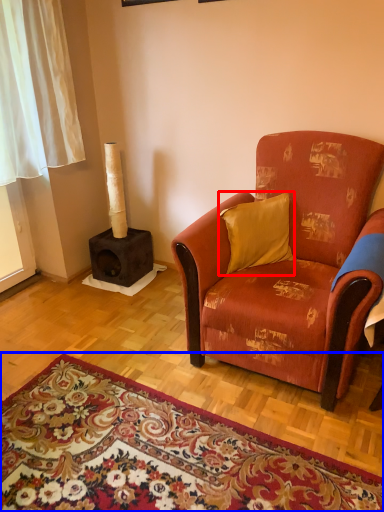
Question: Which of the following is the closest to the observer, pillow (highlighted by a red box) or mat (highlighted by a blue box)?

Choices:
 (A) pillow
 (B) mat

Answer: (B)